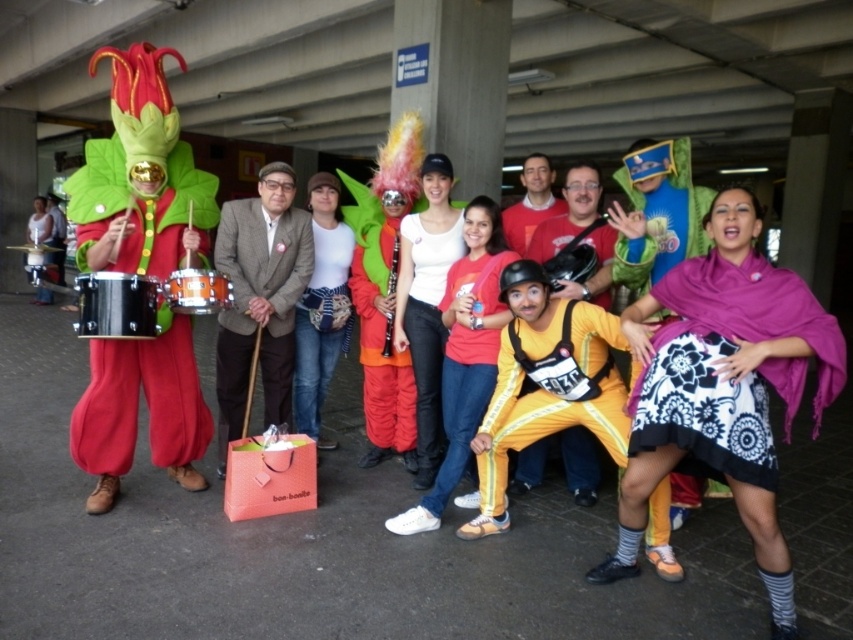
You are standing at the entrance of the parking structure and want to find the matte green costume at left. According to the coordinates provided, in which direction should you look to locate it?

The matte green costume at left is located at coordinates point (140, 177), so you should look to the left side of the image to find it.

You are organizing a parade and need to know if the matte green costume at left can be stored in the same space as the metallic drum at left. Based on their sizes, will they both fit in a storage container designed for the drum?

The matte green costume at left is smaller than the metallic drum at left, so the costume will fit in the drum storage container, but the drum itself may not fit if the container is only sized for the costume.